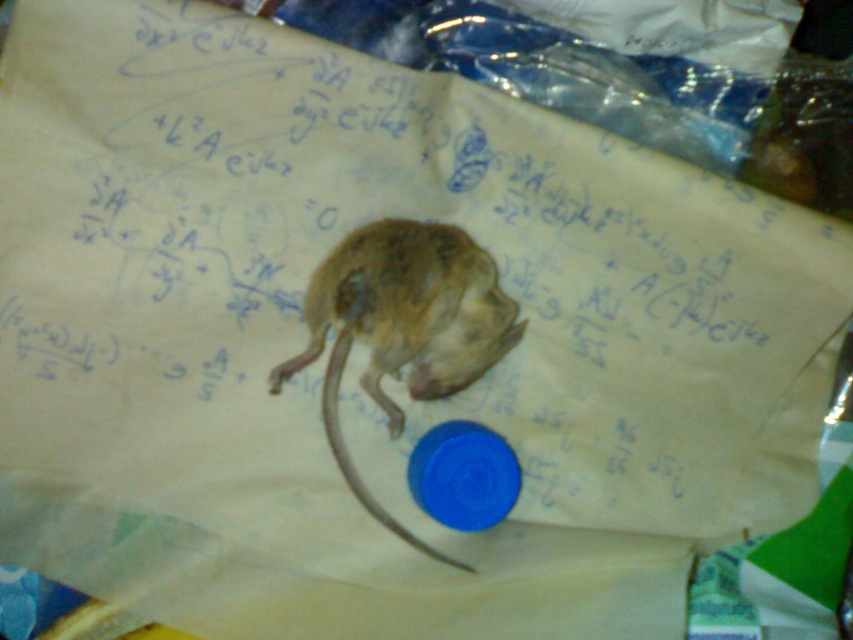
Based on the photo, you are a student who just entered the room and see the fuzzy brown mouse at center and the brown fur tail at center on the paper. Which one is actually the mouse itself?

The fuzzy brown mouse at center is the mouse itself, while the brown fur tail at center belongs to it.

You are a student who just found a mouse on your math homework. The mouse is at the center of the paper, and its tail is also at the center. Can you tell which one is taller between the fuzzy brown mouse at center and the brown fur tail at center?

The fuzzy brown mouse at center is taller than the brown fur tail at center.

You are a student who just walked into the study room and see the fuzzy brown mouse at center and the brown fur tail at center. Which object is closer to you?

The fuzzy brown mouse at center is closer to you because it is further to the viewer than the brown fur tail at center.